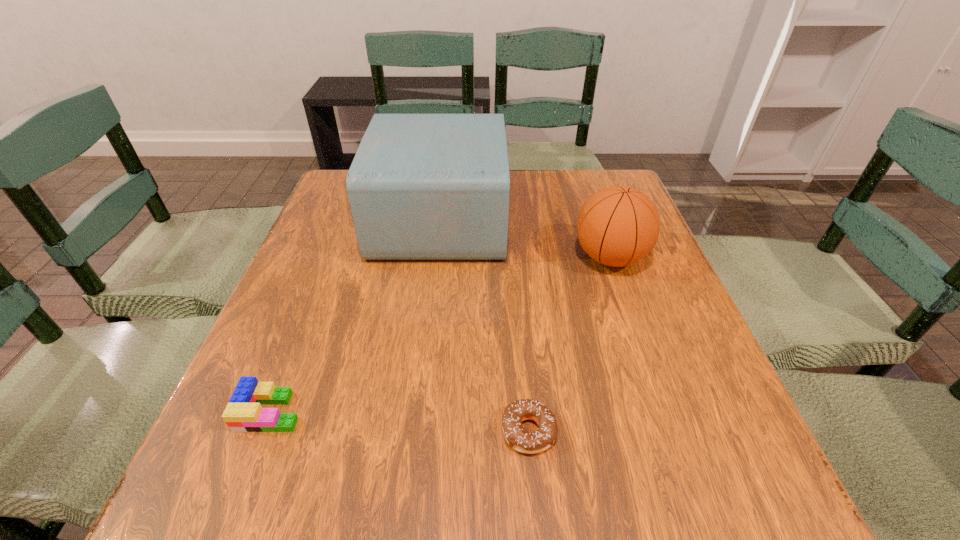
The height and width of the screenshot is (540, 960). I want to click on object located in the far edge section of the desktop, so click(x=421, y=186).

The image size is (960, 540). I want to click on radio receiver that is at the left edge, so click(x=421, y=186).

In order to click on Lego that is positioned at the left edge in this screenshot , I will do `click(243, 413)`.

Identify the location of object located in the right edge section of the desktop. This screenshot has width=960, height=540. (617, 226).

Locate an element on the screen. object that is at the far left corner is located at coordinates pyautogui.click(x=421, y=186).

Where is `vacant area at the far edge of the desktop`? Image resolution: width=960 pixels, height=540 pixels. vacant area at the far edge of the desktop is located at coordinates (560, 187).

Where is `free region at the near edge of the desktop`? The width and height of the screenshot is (960, 540). free region at the near edge of the desktop is located at coordinates (402, 462).

Identify the location of vacant space at the left edge of the desktop. (290, 368).

Locate an element on the screen. This screenshot has width=960, height=540. free region at the right edge of the desktop is located at coordinates (638, 355).

At what (x,y) coordinates should I click in order to perform the action: click on vacant position at the near right corner of the desktop. Please return your answer as a coordinate pair (x, y). Looking at the image, I should click on (718, 460).